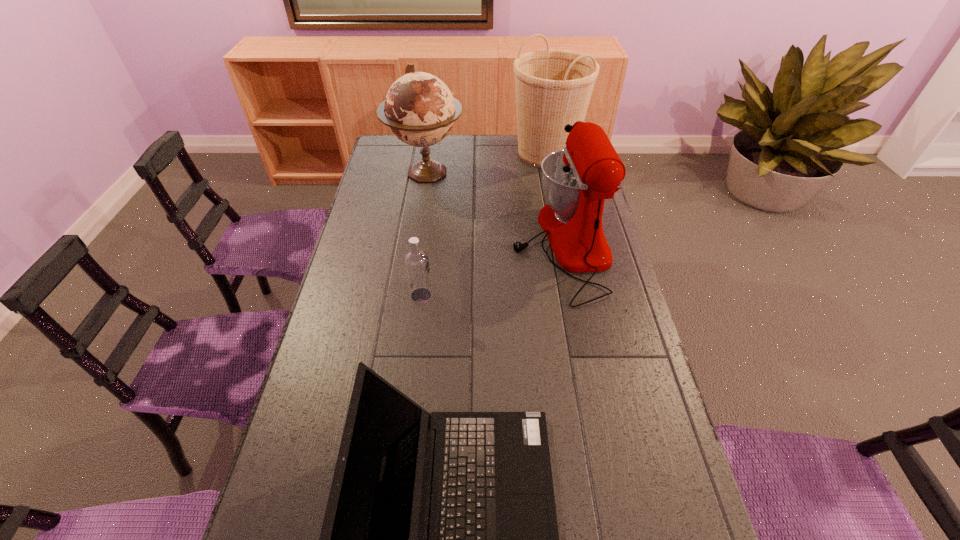
Image resolution: width=960 pixels, height=540 pixels. What are the coordinates of `basket` in the screenshot? It's located at click(553, 87).

Locate an element on the screen. The height and width of the screenshot is (540, 960). globe is located at coordinates (420, 110).

At what (x,y) coordinates should I click in order to perform the action: click on mixer. Please return your answer as a coordinate pair (x, y). The width and height of the screenshot is (960, 540). Looking at the image, I should click on (576, 180).

Where is `vodka`? This screenshot has width=960, height=540. vodka is located at coordinates (416, 261).

The image size is (960, 540). Identify the location of free point located on the left of the basket. (492, 154).

Identify the location of free spot located on the front of the globe showing Asia. This screenshot has width=960, height=540. (416, 239).

Locate an element on the screen. The height and width of the screenshot is (540, 960). free space located on the bowl side of the mixer is located at coordinates (477, 245).

In order to click on vacant space located 0.200m on the bowl side of the mixer in this screenshot , I will do `click(454, 245)`.

Identify the location of free location located 0.340m on the bowl side of the mixer. The image size is (960, 540). (414, 245).

Where is `vacant space located 0.270m on the front label of the vodka`? The width and height of the screenshot is (960, 540). vacant space located 0.270m on the front label of the vodka is located at coordinates [520, 295].